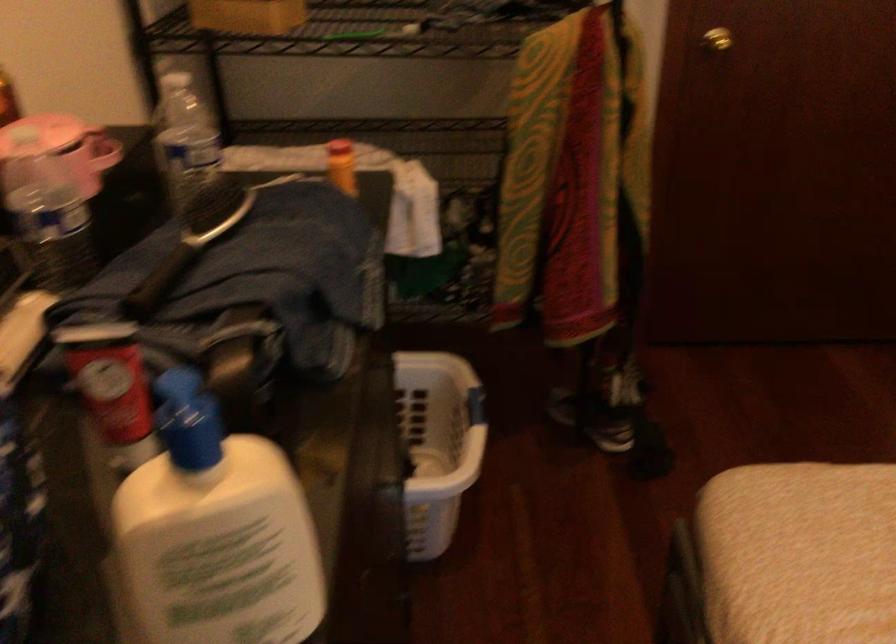
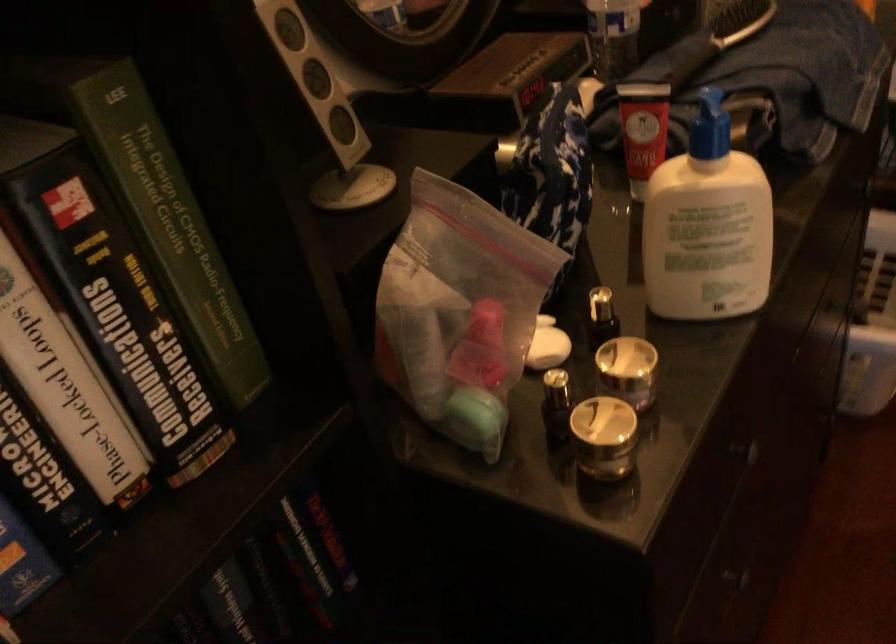
Locate, in the second image, the point that corresponds to [112,383] in the first image.

(642, 129)